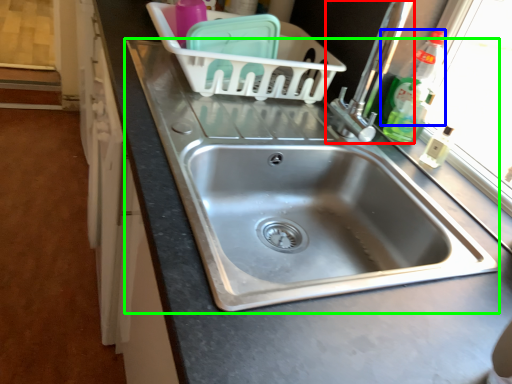
Question: Which object is the closest to the tap (highlighted by a red box)? Choose among these: bottle (highlighted by a blue box) or sink (highlighted by a green box).

Choices:
 (A) bottle
 (B) sink

Answer: (A)